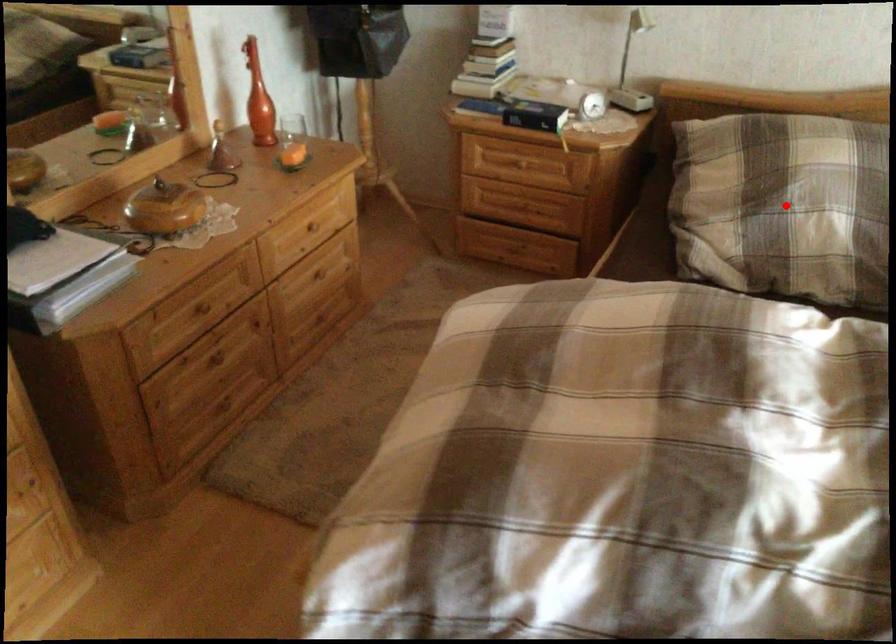
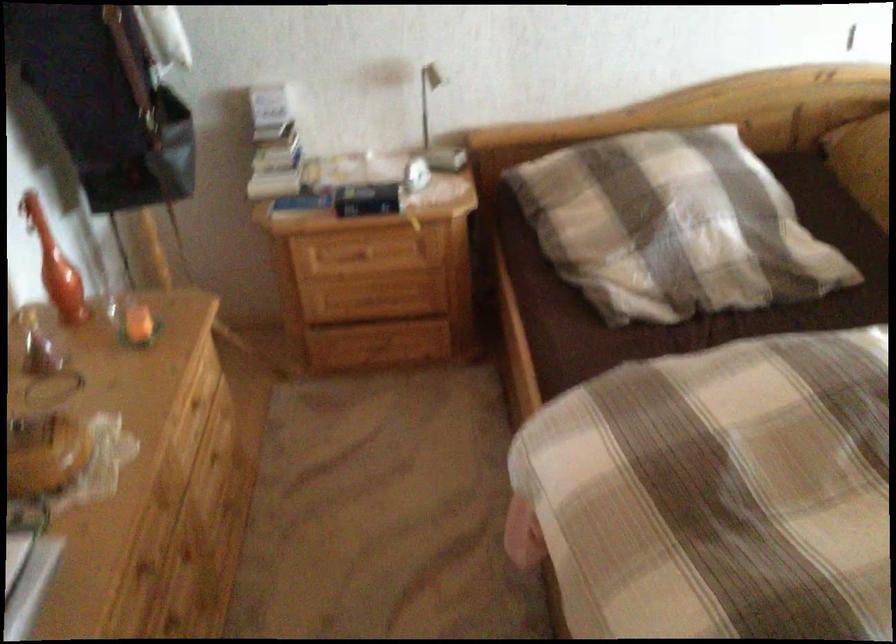
Locate, in the second image, the point that corresponds to the highlighted location in the first image.

(673, 225)